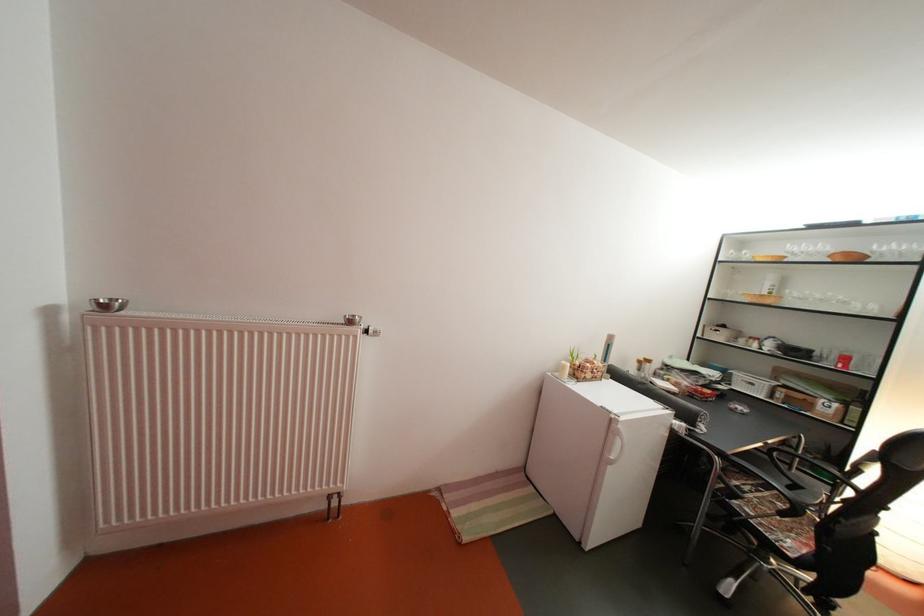
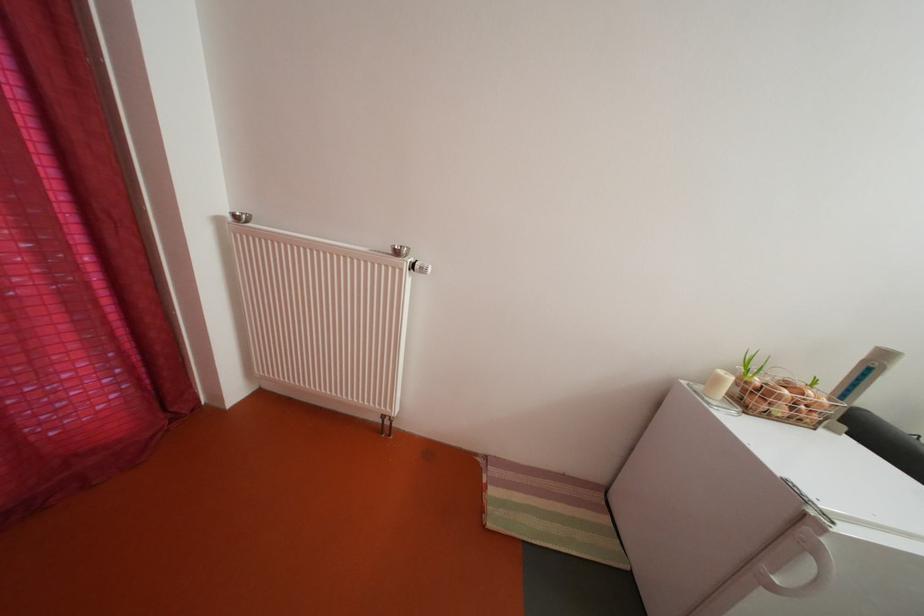
Where in the second image is the point corresponding to the point at 600,382 from the first image?

(792, 416)